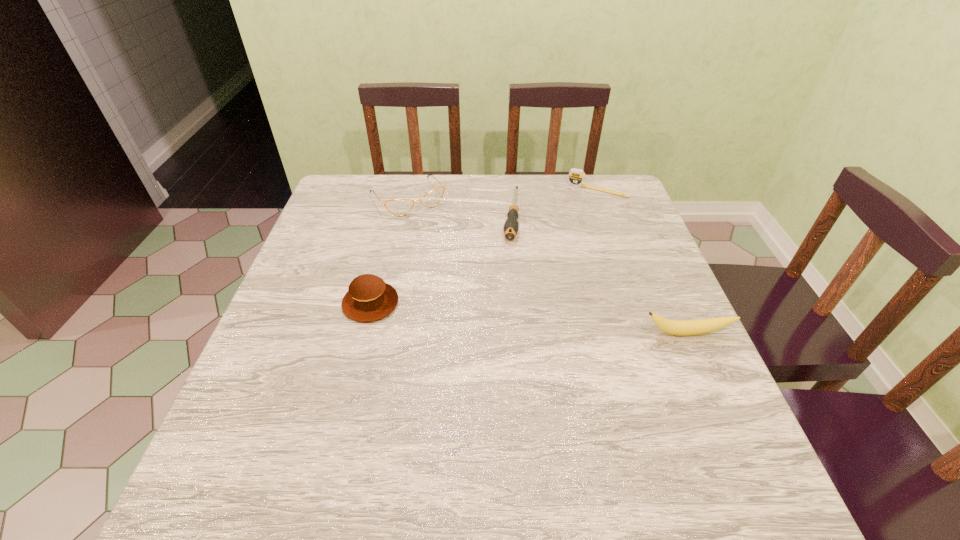
You are a GUI agent. You are given a task and a screenshot of the screen. Output one action in this format:
    pyautogui.click(x=<x>, y=<y>)
    Task: Click on the vacant spot on the desktop that is between the fourth farthest object and the banana and is positioned at the tip of the screwdriver
    This screenshot has width=960, height=540.
    Given the screenshot: What is the action you would take?
    pyautogui.click(x=496, y=315)

What are the coordinates of `vacant space on the desktop that is between the muffin and the banana and is positioned on the front-facing side of the spectacles` in the screenshot? It's located at (495, 315).

Locate an element on the screen. vacant space on the desktop that is between the muffin and the banana and is positioned at the front of the tape measure with the tape extended is located at coordinates (533, 319).